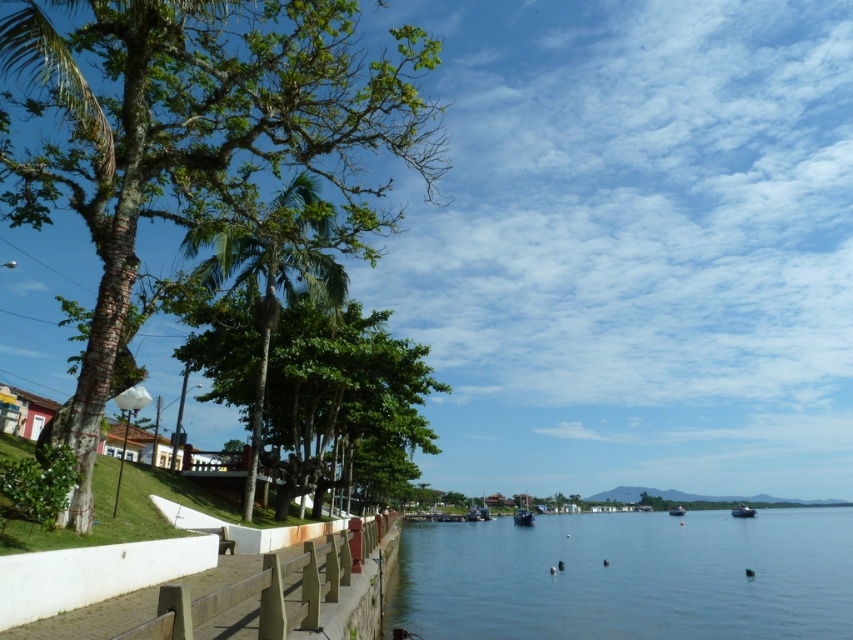
Question: Is clear blue water at lower center to the left of green leafy palm tree at center-left from the viewer's perspective?

Choices:
 (A) no
 (B) yes

Answer: (A)

Question: Considering the real-world distances, which object is farthest from the smooth bark tree at left?

Choices:
 (A) metallic silver boat at lower right
 (B) dark blue plastic boat at center
 (C) clear blue water at lower center
 (D) green leafy palm tree at center-left

Answer: (A)

Question: Is clear blue water at lower center further to camera compared to green leafy palm tree at center-left?

Choices:
 (A) no
 (B) yes

Answer: (B)

Question: Which point appears farthest from the camera in this image?

Choices:
 (A) (596, 595)
 (B) (672, 509)

Answer: (B)

Question: Which of the following is the closest to the observer?

Choices:
 (A) (138, 84)
 (B) (677, 502)
 (C) (438, 573)
 (D) (254, 262)

Answer: (A)

Question: Does green leafy tree at center appear on the left side of metallic silver boat at lower right?

Choices:
 (A) no
 (B) yes

Answer: (B)